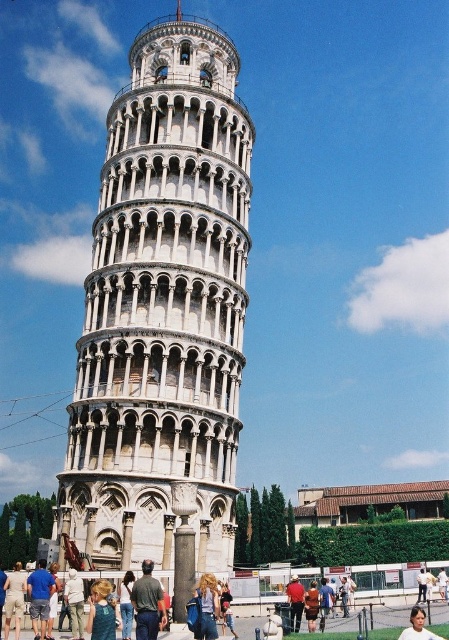
Question: Does blue cotton shirt at lower left lie behind denim jeans at center?

Choices:
 (A) yes
 (B) no

Answer: (A)

Question: Can you confirm if blue denim jeans at center is thinner than brown leather jacket at center?

Choices:
 (A) yes
 (B) no

Answer: (A)

Question: Which point appears closest to the camera in this image?

Choices:
 (A) (38, 627)
 (B) (296, 577)
 (C) (110, 228)
 (D) (12, 572)

Answer: (A)

Question: Which object is positioned closest to the blue cotton shirt at lower left?

Choices:
 (A) brown leather jacket at center
 (B) light brown fabric pants at lower center
 (C) denim jeans at center

Answer: (B)

Question: Considering the relative positions of green fabric shirt at center and brown leather jacket at center in the image provided, where is green fabric shirt at center located with respect to brown leather jacket at center?

Choices:
 (A) above
 (B) below

Answer: (A)

Question: Which point is farther to the camera?

Choices:
 (A) (133, 584)
 (B) (400, 636)

Answer: (B)